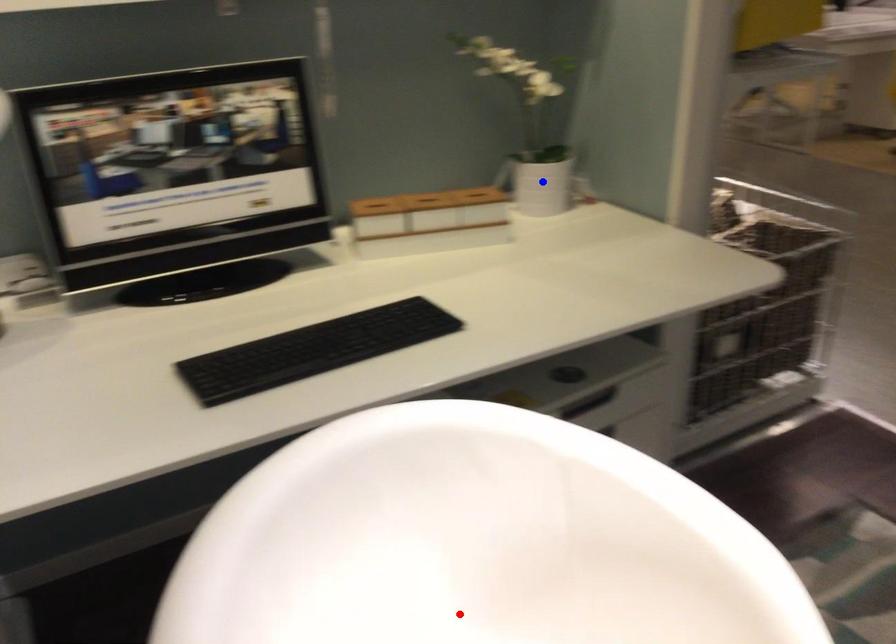
Question: In the image, two points are highlighted. Which point is nearer to the camera? Reply with the corresponding letter.

Choices:
 (A) blue point
 (B) red point

Answer: (B)